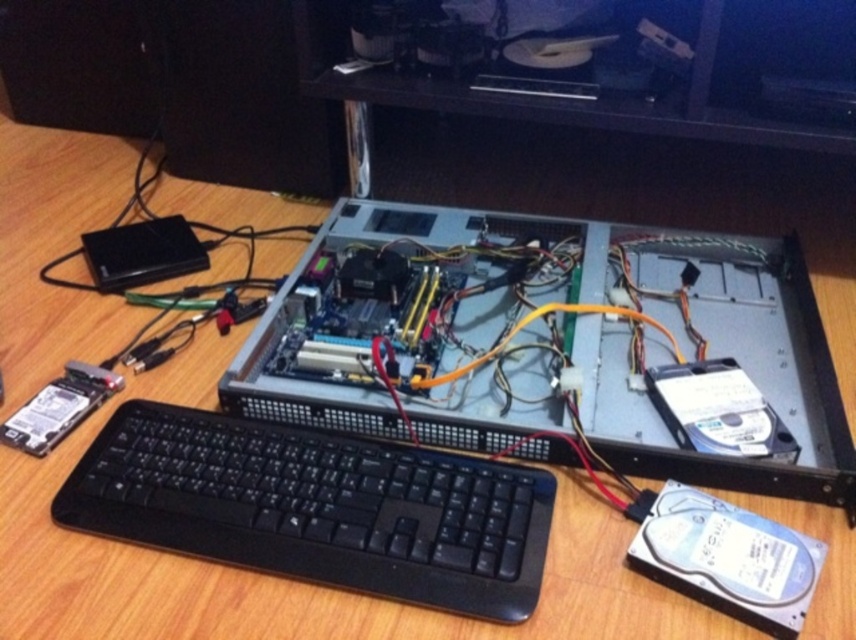
Question: Where is silver metallic computer at center located in relation to black plastic keyboard at lower left in the image?

Choices:
 (A) right
 (B) left

Answer: (A)

Question: Which point appears closest to the camera in this image?

Choices:
 (A) (284, 481)
 (B) (574, 349)

Answer: (A)

Question: Which point appears farthest from the camera in this image?

Choices:
 (A) (73, 483)
 (B) (672, 342)

Answer: (B)

Question: Is silver metallic computer at center above black plastic keyboard at lower left?

Choices:
 (A) yes
 (B) no

Answer: (A)

Question: Does silver metallic computer at center appear over black plastic keyboard at lower left?

Choices:
 (A) no
 (B) yes

Answer: (B)